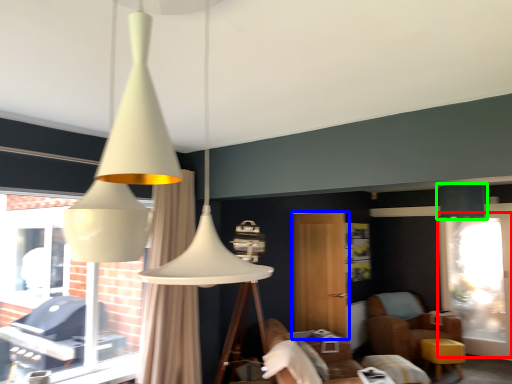
Question: Considering the real-world distances, which object is closest to screen door (highlighted by a red box)? screen door (highlighted by a blue box) or lamp (highlighted by a green box).

Choices:
 (A) screen door
 (B) lamp

Answer: (B)